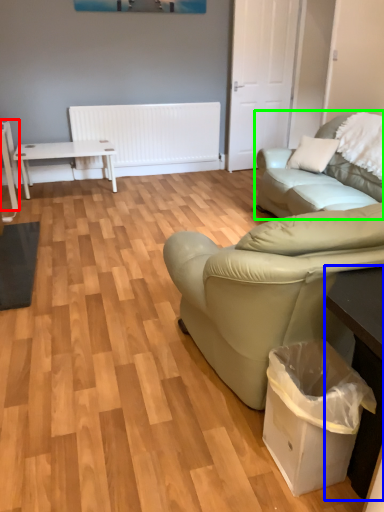
Question: Based on their relative distances, which object is nearer to table (highlighted by a red box)? Choose from table (highlighted by a blue box) and studio couch (highlighted by a green box).

Choices:
 (A) table
 (B) studio couch

Answer: (B)